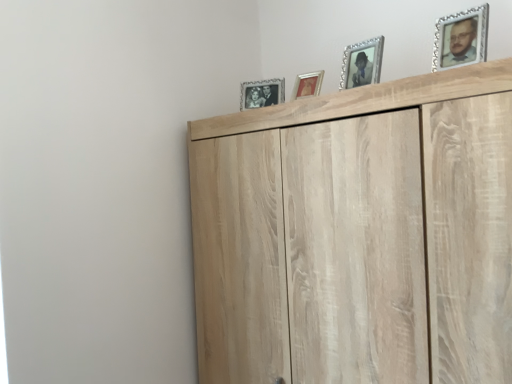
Question: Considering the relative positions of gold-framed picture at upper center, which ranks as the 3th picture frame in front-to-back order, and silver/glass photo frame at upper center, which appears as the first picture frame when viewed from the left, in the image provided, is gold-framed picture at upper center, which ranks as the 3th picture frame in front-to-back order, to the right of silver/glass photo frame at upper center, which appears as the first picture frame when viewed from the left, from the viewer's perspective?

Choices:
 (A) no
 (B) yes

Answer: (B)

Question: From the image's perspective, is gold-framed picture at upper center, placed as the 3th picture frame when sorted from right to left, under silver/glass photo frame at upper center, which appears as the first picture frame when viewed from the left?

Choices:
 (A) yes
 (B) no

Answer: (A)

Question: Considering the relative sizes of gold-framed picture at upper center, acting as the 2th picture frame starting from the back, and silver/glass photo frame at upper center, which appears as the first picture frame when viewed from the left, in the image provided, is gold-framed picture at upper center, acting as the 2th picture frame starting from the back, taller than silver/glass photo frame at upper center, which appears as the first picture frame when viewed from the left,?

Choices:
 (A) no
 (B) yes

Answer: (A)

Question: Is gold-framed picture at upper center, which ranks as the 3th picture frame in front-to-back order, next to silver/glass photo frame at upper center, which appears as the first picture frame when viewed from the left?

Choices:
 (A) no
 (B) yes

Answer: (A)

Question: Is gold-framed picture at upper center, the 2th picture frame positioned from the left, not close to silver/glass photo frame at upper center, placed as the 1th picture frame when sorted from back to front?

Choices:
 (A) yes
 (B) no

Answer: (B)

Question: Is point (425, 215) positioned closer to the camera than point (357, 51)?

Choices:
 (A) farther
 (B) closer

Answer: (B)

Question: Considering the positions of light wood cupboard at upper center and silver/glass photo frame at upper center, the third picture frame positioned from the back, in the image, is light wood cupboard at upper center bigger or smaller than silver/glass photo frame at upper center, the third picture frame positioned from the back,?

Choices:
 (A) big
 (B) small

Answer: (A)

Question: Considering their positions, is light wood cupboard at upper center located in front of or behind silver/glass photo frame at upper center, the second picture frame when ordered from front to back?

Choices:
 (A) front
 (B) behind

Answer: (A)

Question: Looking at their shapes, would you say light wood cupboard at upper center is wider or thinner than silver/glass photo frame at upper center, which is the second picture frame from right to left?

Choices:
 (A) thin
 (B) wide

Answer: (B)

Question: Considering the positions of light wood cupboard at upper center and silver/glass picture frame at upper right, acting as the 1th picture frame starting from the right, in the image, is light wood cupboard at upper center wider or thinner than silver/glass picture frame at upper right, acting as the 1th picture frame starting from the right,?

Choices:
 (A) wide
 (B) thin

Answer: (A)

Question: Is light wood cupboard at upper center in front of or behind silver/glass picture frame at upper right, marked as the fourth picture frame in a back-to-front arrangement, in the image?

Choices:
 (A) front
 (B) behind

Answer: (A)

Question: Would you say light wood cupboard at upper center is to the left or to the right of silver/glass picture frame at upper right, which is the 4th picture frame in left-to-right order, in the picture?

Choices:
 (A) right
 (B) left

Answer: (B)

Question: In terms of height, does light wood cupboard at upper center look taller or shorter compared to silver/glass picture frame at upper right, acting as the 1th picture frame starting from the right?

Choices:
 (A) tall
 (B) short

Answer: (A)

Question: Is point (381, 46) closer or farther from the camera than point (347, 92)?

Choices:
 (A) closer
 (B) farther

Answer: (B)

Question: From the image's perspective, is silver/glass photo frame at upper center, the second picture frame when ordered from front to back, positioned above or below light wood cupboard at upper center?

Choices:
 (A) below
 (B) above

Answer: (B)